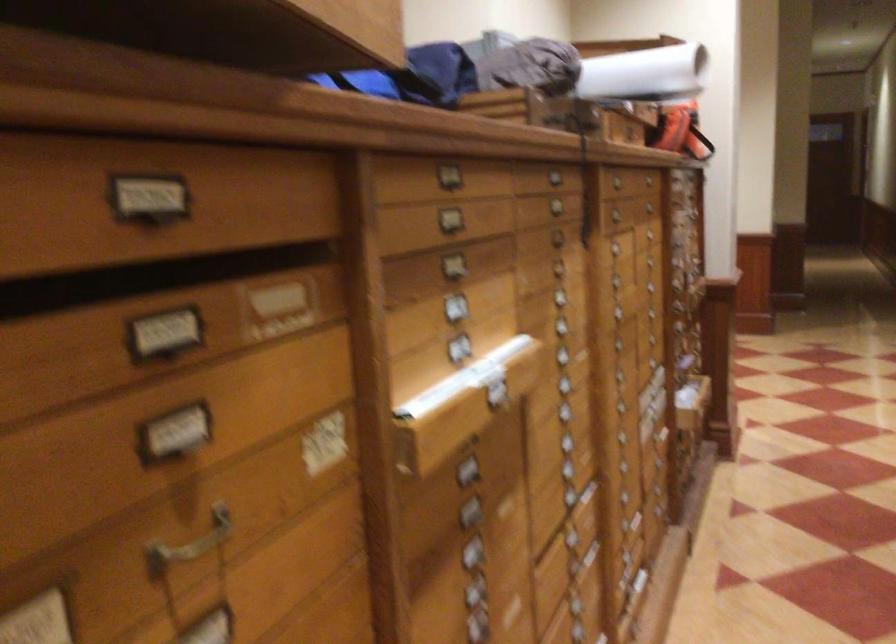
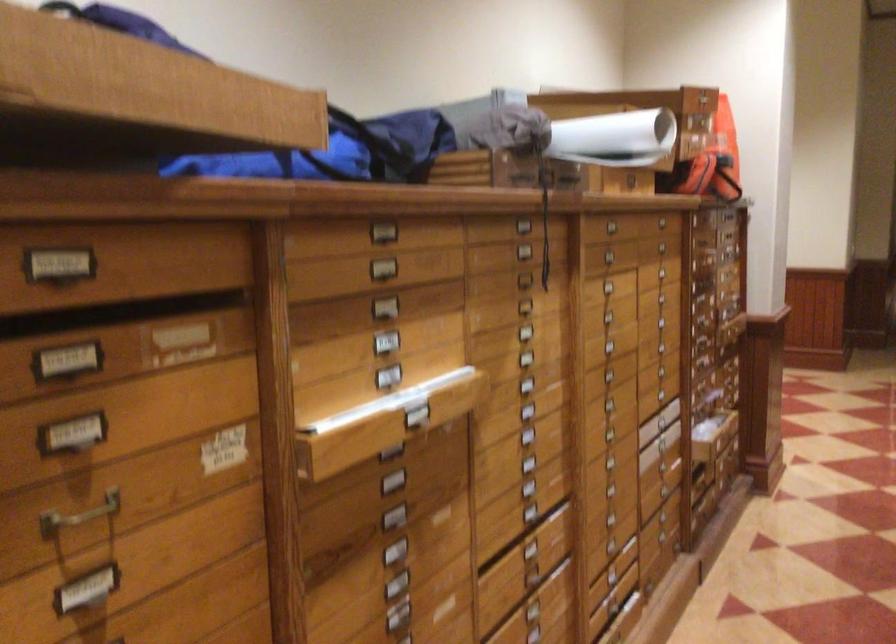
Locate, in the second image, the point that corresponds to pixel 691 118 in the first image.

(717, 160)